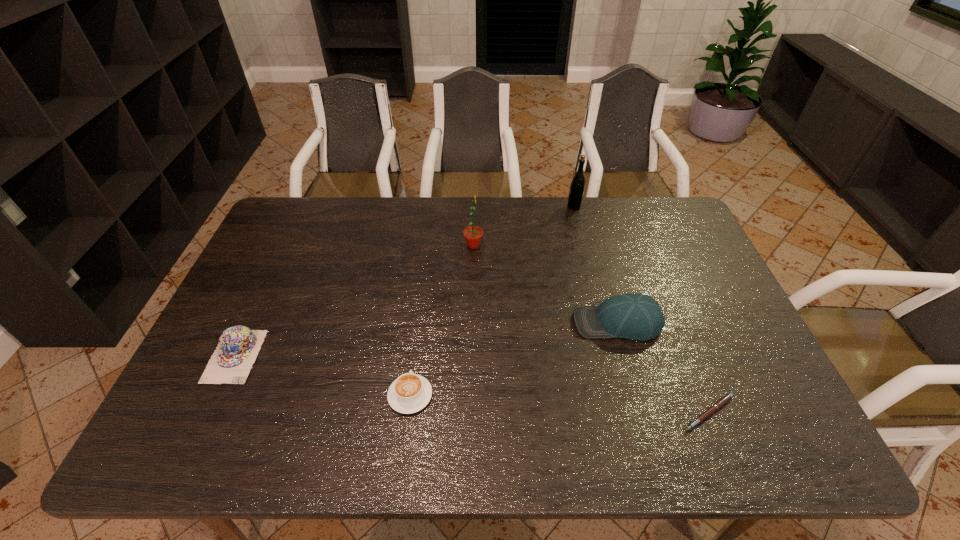
Locate an element on the screen. empty space that is in between the fourth shortest object and the second object from left to right is located at coordinates (514, 359).

Identify the location of empty space between the baseball cap and the fourth object from right to left. (545, 284).

Where is `free point between the third object from left to right and the leftmost object`? Image resolution: width=960 pixels, height=540 pixels. free point between the third object from left to right and the leftmost object is located at coordinates (354, 301).

In order to click on vacant point located between the fourth shortest object and the shortest object in this screenshot , I will do `click(662, 368)`.

The image size is (960, 540). Identify the location of blank region between the beer bottle and the baseball cap. (595, 265).

The width and height of the screenshot is (960, 540). What are the coordinates of `free space between the third shortest object and the sunflower` in the screenshot? It's located at (354, 301).

Select which object is the fifth closest to the baseball cap. Please provide its 2D coordinates. Your answer should be formatted as a tuple, i.e. [(x, y)], where the tuple contains the x and y coordinates of a point satisfying the conditions above.

[(238, 347)]

I want to click on object that is the second closest one to the fourth object from right to left, so [x=577, y=186].

Where is `free spot that satisfies the following two spatial constraints: 1. on the face of the baseball cap; 2. on the left side of the sunflower`? This screenshot has width=960, height=540. free spot that satisfies the following two spatial constraints: 1. on the face of the baseball cap; 2. on the left side of the sunflower is located at coordinates (472, 323).

Identify the location of vacant point that satisfies the following two spatial constraints: 1. on the face of the third object from left to right; 2. on the front, side, and top of the leftmost object. (471, 356).